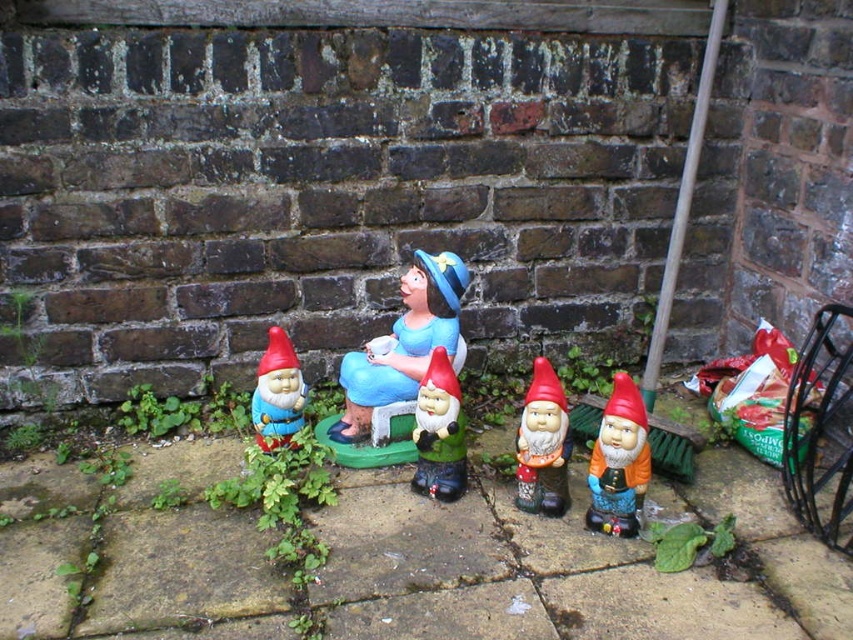
Question: Is matte ceramic figure at center above green matte gnome at center?

Choices:
 (A) yes
 (B) no

Answer: (A)

Question: Estimate the real-world distances between objects in this image. Which object is closer to the matte ceramic figure at center?

Choices:
 (A) matte plastic gnome at center
 (B) orange matte gnome at right

Answer: (A)

Question: Which of the following is the farthest from the observer?

Choices:
 (A) orange matte gnome at right
 (B) matte plastic gnome at center

Answer: (B)

Question: Which point is farther from the camera taking this photo?

Choices:
 (A) (418, 426)
 (B) (387, 376)
 (C) (276, 369)
 (D) (550, 388)

Answer: (B)

Question: Does green matte gnome at center appear on the left side of matte plastic gnome at left?

Choices:
 (A) yes
 (B) no

Answer: (B)

Question: Can you confirm if matte ceramic figure at center is positioned to the left of matte plastic gnome at left?

Choices:
 (A) yes
 (B) no

Answer: (B)